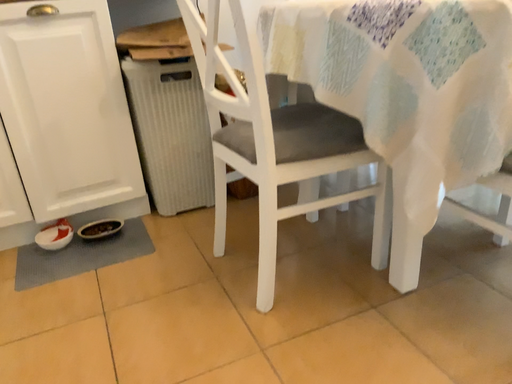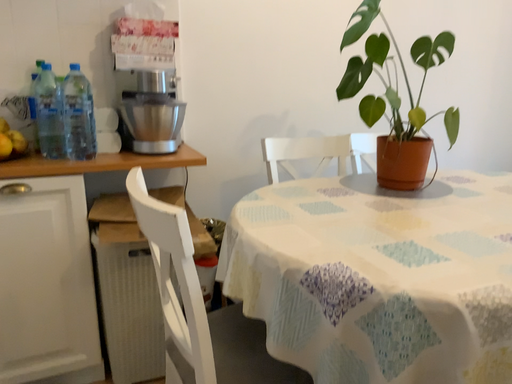
Question: How did the camera likely rotate when shooting the video?

Choices:
 (A) rotated upward
 (B) rotated downward

Answer: (A)